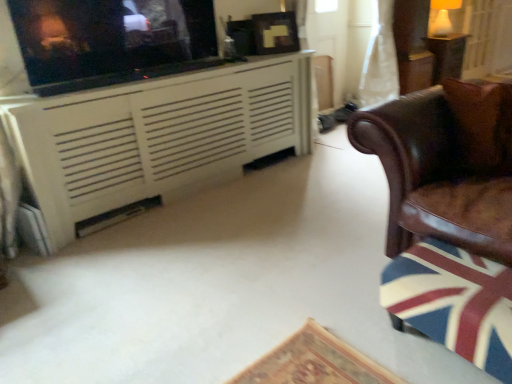
Question: From a real-world perspective, is white painted wood cabinet at upper left located higher than white sheer curtain at upper right?

Choices:
 (A) yes
 (B) no

Answer: (B)

Question: Does white painted wood cabinet at upper left have a lesser height compared to white sheer curtain at upper right?

Choices:
 (A) no
 (B) yes

Answer: (B)

Question: Is white painted wood cabinet at upper left in contact with white sheer curtain at upper right?

Choices:
 (A) no
 (B) yes

Answer: (A)

Question: Considering the relative sizes of white painted wood cabinet at upper left and white sheer curtain at upper right in the image provided, is white painted wood cabinet at upper left thinner than white sheer curtain at upper right?

Choices:
 (A) yes
 (B) no

Answer: (A)

Question: Does white painted wood cabinet at upper left have a larger size compared to white sheer curtain at upper right?

Choices:
 (A) no
 (B) yes

Answer: (B)

Question: From a real-world perspective, is wooden table at upper right positioned above or below white sheer curtain at upper right?

Choices:
 (A) above
 (B) below

Answer: (B)

Question: Looking at their shapes, would you say wooden table at upper right is wider or thinner than white sheer curtain at upper right?

Choices:
 (A) thin
 (B) wide

Answer: (A)

Question: Considering the relative positions of wooden table at upper right and white sheer curtain at upper right in the image provided, is wooden table at upper right to the left or to the right of white sheer curtain at upper right?

Choices:
 (A) left
 (B) right

Answer: (B)

Question: In the image, is wooden table at upper right positioned in front of or behind white sheer curtain at upper right?

Choices:
 (A) behind
 (B) front

Answer: (A)

Question: Considering the positions of brown leather chair at right and wooden swivel chair at right in the image, is brown leather chair at right wider or thinner than wooden swivel chair at right?

Choices:
 (A) wide
 (B) thin

Answer: (A)

Question: In terms of height, does brown leather chair at right look taller or shorter compared to wooden swivel chair at right?

Choices:
 (A) short
 (B) tall

Answer: (B)

Question: Would you say brown leather chair at right is to the left or to the right of wooden swivel chair at right in the picture?

Choices:
 (A) left
 (B) right

Answer: (B)

Question: Is point (502, 246) closer or farther from the camera than point (495, 336)?

Choices:
 (A) closer
 (B) farther

Answer: (B)

Question: From the image's perspective, is brown leather chair at right above or below wooden table at upper right?

Choices:
 (A) below
 (B) above

Answer: (A)

Question: Do you think brown leather chair at right is within wooden table at upper right, or outside of it?

Choices:
 (A) outside
 (B) inside

Answer: (A)